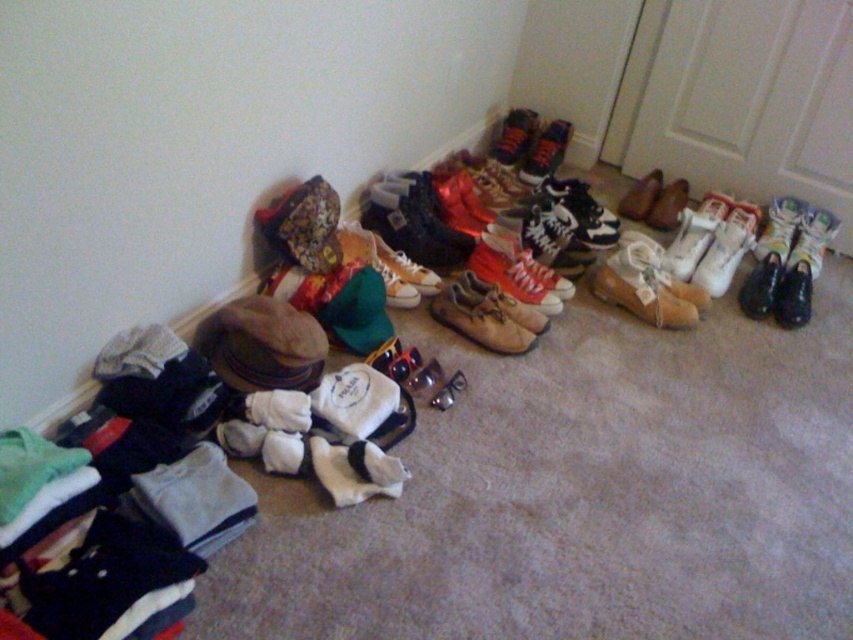
Question: Considering the relative positions of leather tan boot at center-right and leather sneaker at center in the image provided, where is leather tan boot at center-right located with respect to leather sneaker at center?

Choices:
 (A) right
 (B) left

Answer: (A)

Question: Which object appears farthest from the camera in this image?

Choices:
 (A) leather at center
 (B) brown leather shoe at center

Answer: (B)

Question: In this image, where is leather at center located relative to black leather shoe at center-right?

Choices:
 (A) right
 (B) left

Answer: (B)

Question: Considering the relative positions of white leather sneaker at upper right and white leather sneaker at center right in the image provided, where is white leather sneaker at upper right located with respect to white leather sneaker at center right?

Choices:
 (A) below
 (B) above

Answer: (A)

Question: Which object is closer to the camera taking this photo?

Choices:
 (A) leather sneaker at center
 (B) leather at center

Answer: (B)

Question: Among these objects, which one is nearest to the camera?

Choices:
 (A) brown suede shoe at center
 (B) white leather sneaker at upper right
 (C) leather at center

Answer: (C)